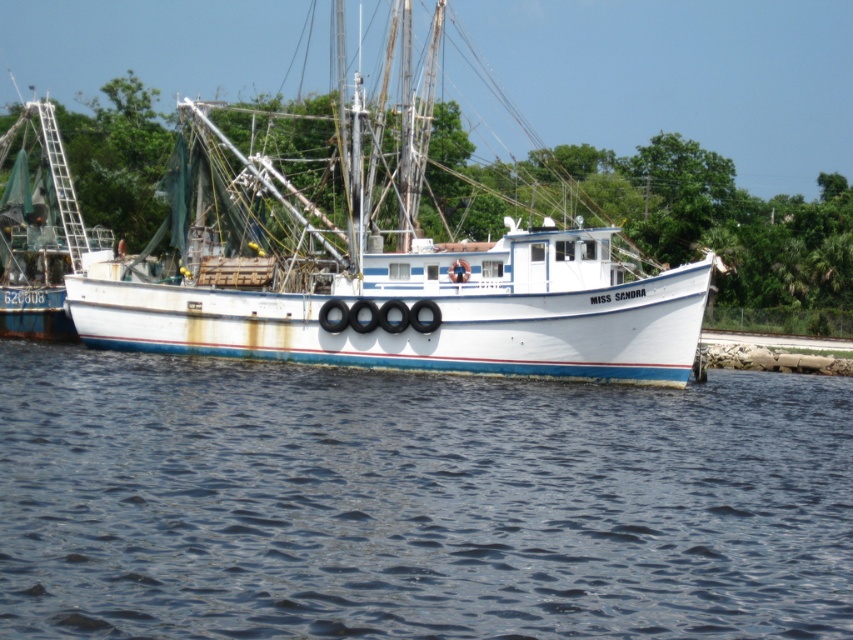
You are standing on the dock next to the Miss Sandra fishing boat. You notice the blue water at center and the white matte boat at center. Which object is positioned to the right of the other?

The blue water at center is to the right of the white matte boat at center.

You are standing on the dock and looking at the blue water at center and the white matte boat at center. Which one is nearer to you?

The blue water at center is closer to the viewer than the white matte boat at center.

You are standing on the dock next to the fishing boat Miss Sandra. There is a point at coordinates point (x=764, y=458) that you want to reach. Can you walk directly to that point from your current position?

The point at coordinates point (x=764, y=458) is 129.28 feet away from you. Since this distance is quite large, you would need to find a way to traverse that distance, possibly by boat or using another method, as walking directly may not be feasible on the dock.